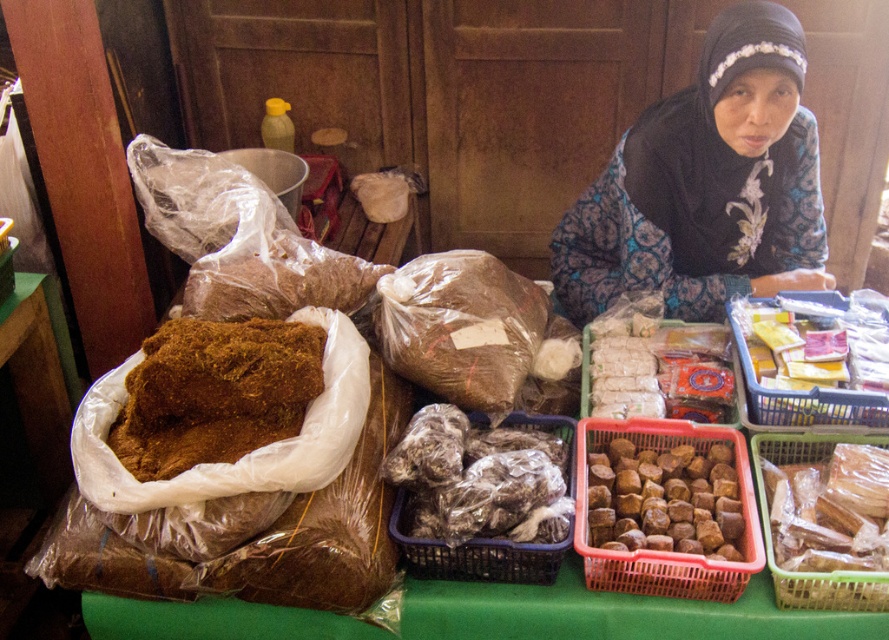
Consider the image. You are a customer at the market stall and want to buy some nuts. You see the translucent plastic basket at center and the translucent plastic basket at lower right. Which basket should you choose if you want to buy a larger quantity?

The translucent plastic basket at center has a larger size compared to the translucent plastic basket at lower right, so you should choose the translucent plastic basket at center to buy a larger quantity.

You are a customer at the market stall and want to buy some nuts. You see the brown woven basket at center and the translucent plastic basket at center on the table. Which basket should you look into first if you want to find the nuts?

The brown woven basket at center is to the right of the translucent plastic basket at center. Since the nuts are in the brown woven basket at center, you should look into the brown woven basket at center first.